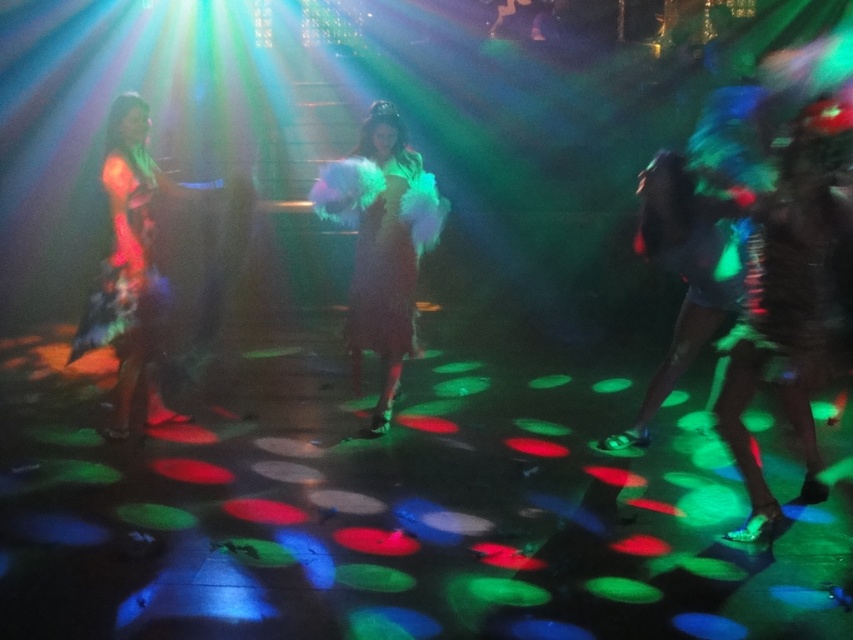
Question: Which point is closer to the camera?

Choices:
 (A) (335, 182)
 (B) (763, 307)
 (C) (643, 424)

Answer: (B)

Question: Is fuzzy black dress at right below shiny metallic dress at right?

Choices:
 (A) no
 (B) yes

Answer: (B)

Question: Is fuzzy multicolored boa at center wider than shiny metallic dress at right?

Choices:
 (A) no
 (B) yes

Answer: (B)

Question: Is shiny metallic dress at left further to the viewer compared to shiny metallic dress at right?

Choices:
 (A) yes
 (B) no

Answer: (A)

Question: Which of the following is the farthest from the observer?

Choices:
 (A) fuzzy multicolored boa at center
 (B) fuzzy black dress at right
 (C) shiny metallic dress at left

Answer: (A)

Question: Which object is farther from the camera taking this photo?

Choices:
 (A) shiny metallic dress at right
 (B) fuzzy multicolored boa at center
 (C) fuzzy black dress at right
 (D) shiny metallic dress at left

Answer: (B)